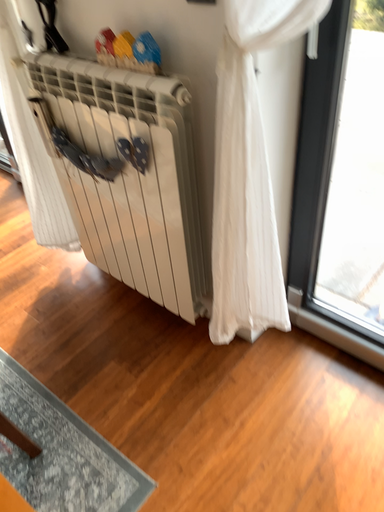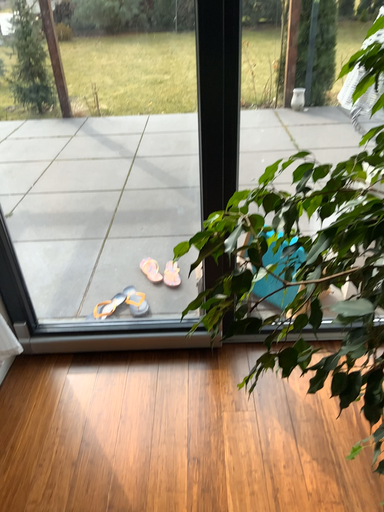
Question: How did the camera likely rotate when shooting the video?

Choices:
 (A) rotated downward
 (B) rotated upward

Answer: (B)